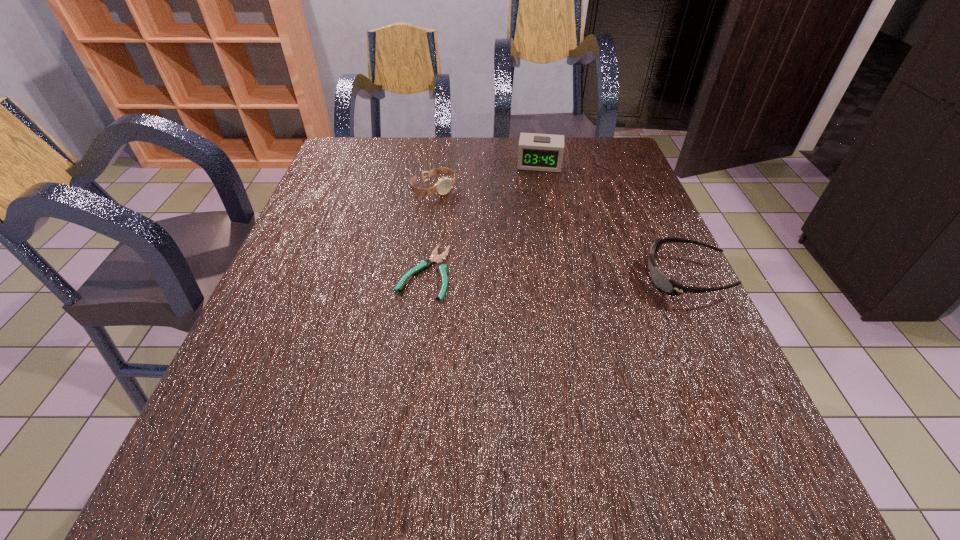
This screenshot has height=540, width=960. What are the coordinates of `free space at the right edge of the desktop` in the screenshot? It's located at (609, 272).

Find the location of a particular element. vacant space at the far left corner of the desktop is located at coordinates click(360, 156).

Find the location of a particular element. The height and width of the screenshot is (540, 960). free point between the tallest object and the rightmost object is located at coordinates (612, 221).

Identify the location of free space between the third object from left to right and the watch. (487, 177).

At what (x,y) coordinates should I click in order to perform the action: click on vacant area between the shortest object and the watch. Please return your answer as a coordinate pair (x, y). The image size is (960, 540). Looking at the image, I should click on (429, 231).

Locate an element on the screen. The height and width of the screenshot is (540, 960). free point between the second object from right to left and the pliers is located at coordinates [x=482, y=219].

This screenshot has width=960, height=540. I want to click on vacant space that's between the sunglasses and the alarm clock, so click(612, 221).

At what (x,y) coordinates should I click in order to perform the action: click on free space between the alarm clock and the third nearest object. Please return your answer as a coordinate pair (x, y). Image resolution: width=960 pixels, height=540 pixels. Looking at the image, I should click on (487, 177).

I want to click on vacant space that's between the alarm clock and the second farthest object, so click(487, 177).

This screenshot has width=960, height=540. Identify the location of free area in between the sunglasses and the second object from right to left. (612, 221).